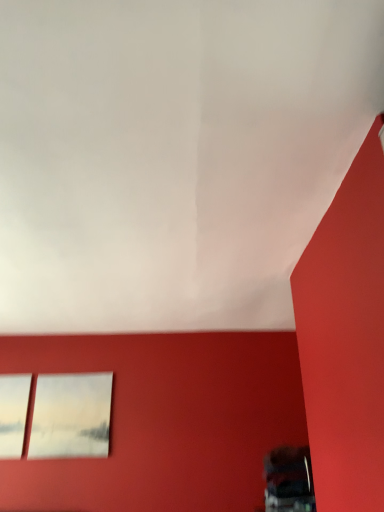
Question: Considering their positions, is transparent glass window at lower left located in front of or behind matte white picture frame at upper left?

Choices:
 (A) front
 (B) behind

Answer: (A)

Question: Based on their sizes in the image, would you say transparent glass window at lower left is bigger or smaller than matte white picture frame at upper left?

Choices:
 (A) big
 (B) small

Answer: (B)

Question: Is transparent glass window at lower left inside the boundaries of matte white picture frame at upper left, or outside?

Choices:
 (A) outside
 (B) inside

Answer: (A)

Question: Does point (67, 453) appear closer or farther from the camera than point (6, 432)?

Choices:
 (A) farther
 (B) closer

Answer: (B)

Question: Is matte white picture frame at upper left spatially inside transparent glass window at lower left, or outside of it?

Choices:
 (A) inside
 (B) outside

Answer: (B)

Question: Is matte white picture frame at upper left taller or shorter than transparent glass window at lower left?

Choices:
 (A) tall
 (B) short

Answer: (A)

Question: Considering the positions of matte white picture frame at upper left and transparent glass window at lower left in the image, is matte white picture frame at upper left wider or thinner than transparent glass window at lower left?

Choices:
 (A) wide
 (B) thin

Answer: (B)